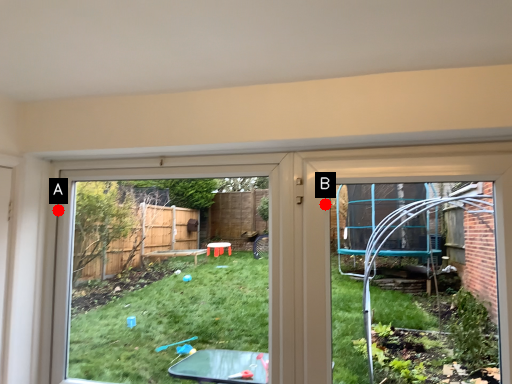
Question: Two points are circled on the image, labeled by A and B beside each circle. Among these points, which one is nearest to the camera?

Choices:
 (A) A is closer
 (B) B is closer

Answer: (B)